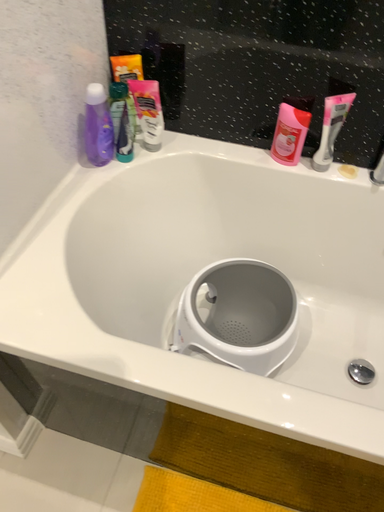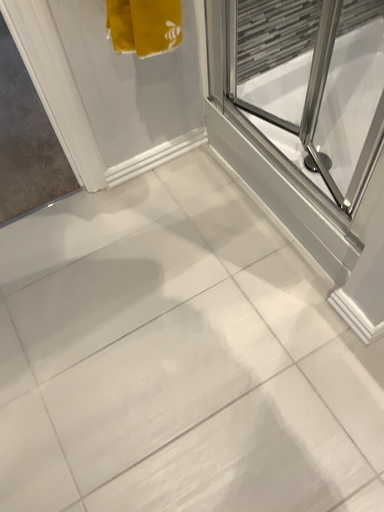
Question: How did the camera likely rotate when shooting the video?

Choices:
 (A) rotated right
 (B) rotated left

Answer: (B)